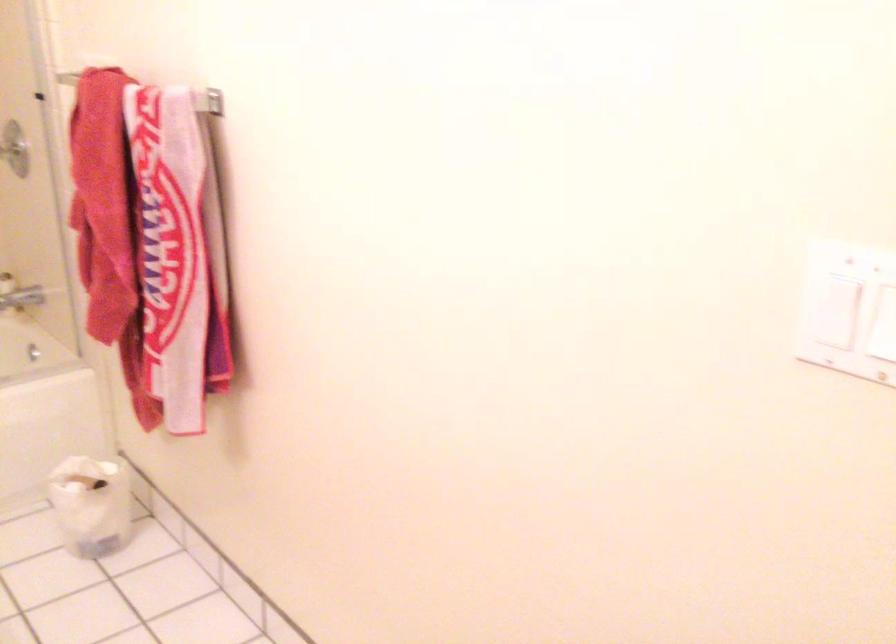
In order to click on chrome faucet handle in this screenshot , I will do `click(20, 299)`.